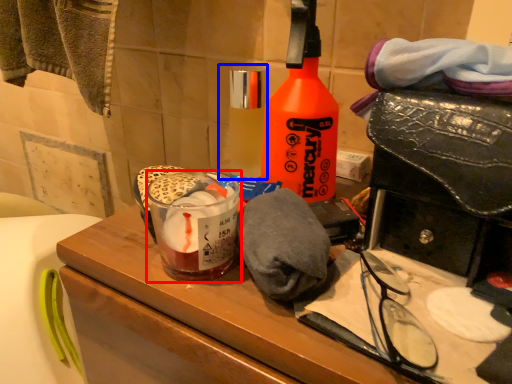
Question: Which object is further to the camera taking this photo, beverage (highlighted by a red box) or bottle (highlighted by a blue box)?

Choices:
 (A) beverage
 (B) bottle

Answer: (B)